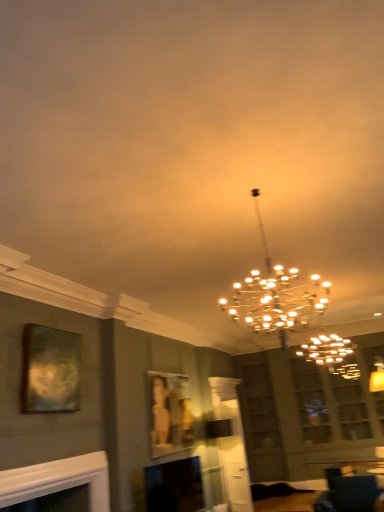
In order to face matte gold picture frame at center, placed as the first picture frame when sorted from bottom to top, should I rotate leftwards or rightwards?

Rotate left and turn 2.706 degrees.

The width and height of the screenshot is (384, 512). Describe the element at coordinates (349, 494) in the screenshot. I see `velvet dark blue sofa at lower right` at that location.

What are the coordinates of `white glossy fireplace at lower left, arranged as the 1th fireplace when viewed from the front` in the screenshot? It's located at (58, 480).

Identify the location of matte black fireplace at lower left, which is the second fireplace from front to back. (174, 486).

This screenshot has height=512, width=384. Find the location of `matte gold picture frame at center, acting as the first picture frame starting from the right`. matte gold picture frame at center, acting as the first picture frame starting from the right is located at coordinates (169, 413).

From a real-world perspective, relative to metallic gold picture frame at upper left, the second picture frame in the bottom-to-top sequence, is metallic gold chandelier at center vertically above or below?

Clearly, from a real-world perspective, metallic gold chandelier at center is above metallic gold picture frame at upper left, the second picture frame in the bottom-to-top sequence.

Which is less distant, (x=293, y=292) or (x=44, y=394)?

The point (x=44, y=394) is closer.

Between metallic gold chandelier at center and metallic gold picture frame at upper left, the second picture frame in the bottom-to-top sequence, which one has larger width?

metallic gold chandelier at center.

I want to click on the 1st picture frame behind the metallic gold chandelier at center, starting your count from the anchor, so click(50, 370).

Is point (340, 496) farther from viewer compared to point (168, 380)?

No, (340, 496) is closer to viewer.

From the image's perspective, relative to matte gold picture frame at center, acting as the first picture frame starting from the right, is velvet dark blue sofa at lower right above or below?

From the image's perspective, velvet dark blue sofa at lower right appears below matte gold picture frame at center, acting as the first picture frame starting from the right.

Which picture frame is the 1st one when counting from the left side of the velvet dark blue sofa at lower right? Please provide its 2D coordinates.

[(169, 413)]

From a real-world perspective, is velvet dark blue sofa at lower right positioned under matte gold picture frame at center, which appears as the second picture frame when viewed from the top, based on gravity?

Correct, in the physical world, velvet dark blue sofa at lower right is lower than matte gold picture frame at center, which appears as the second picture frame when viewed from the top.

Is metallic gold picture frame at upper left, positioned as the second picture frame in right-to-left order, behind velvet dark blue sofa at lower right?

No.

Visually, is metallic gold picture frame at upper left, the second picture frame in the bottom-to-top sequence, positioned to the left or to the right of velvet dark blue sofa at lower right?

From the image, it's evident that metallic gold picture frame at upper left, the second picture frame in the bottom-to-top sequence, is to the left of velvet dark blue sofa at lower right.

Is metallic gold picture frame at upper left, the second picture frame in the bottom-to-top sequence, thinner than velvet dark blue sofa at lower right?

Correct, the width of metallic gold picture frame at upper left, the second picture frame in the bottom-to-top sequence, is less than that of velvet dark blue sofa at lower right.

Consider the image. Is velvet dark blue sofa at lower right inside metallic gold picture frame at upper left, the 1th picture frame positioned from the left?

That's incorrect, velvet dark blue sofa at lower right is not inside metallic gold picture frame at upper left, the 1th picture frame positioned from the left.

From a real-world perspective, between white glossy fireplace at lower left, the second fireplace viewed from the back, and matte gold picture frame at center, placed as the first picture frame when sorted from bottom to top, who is vertically lower?

white glossy fireplace at lower left, the second fireplace viewed from the back, from a real-world perspective.

Is white glossy fireplace at lower left, the 1th fireplace when ordered from left to right, oriented towards matte gold picture frame at center, positioned as the second picture frame in front-to-back order?

No.

Based on the photo, is white glossy fireplace at lower left, the second fireplace viewed from the back, spatially inside matte gold picture frame at center, the 2th picture frame from the left, or outside of it?

white glossy fireplace at lower left, the second fireplace viewed from the back, cannot be found inside matte gold picture frame at center, the 2th picture frame from the left.

From the image's perspective, who appears lower, white glossy fireplace at lower left, arranged as the second fireplace when viewed from the right, or matte gold picture frame at center, acting as the first picture frame starting from the right?

From the image's view, matte gold picture frame at center, acting as the first picture frame starting from the right, is below.

Is metallic gold picture frame at upper left, the second picture frame in the bottom-to-top sequence, spatially inside metallic gold chandelier at center, or outside of it?

metallic gold picture frame at upper left, the second picture frame in the bottom-to-top sequence, is outside metallic gold chandelier at center.

Does metallic gold picture frame at upper left, the second picture frame in the bottom-to-top sequence, have a greater width compared to metallic gold chandelier at center?

No, metallic gold picture frame at upper left, the second picture frame in the bottom-to-top sequence, is not wider than metallic gold chandelier at center.

Which of these two, metallic gold picture frame at upper left, which is the 1th picture frame in top-to-bottom order, or metallic gold chandelier at center, is smaller?

With smaller size is metallic gold picture frame at upper left, which is the 1th picture frame in top-to-bottom order.

Consider the image. Is metallic gold picture frame at upper left, placed as the 2th picture frame when sorted from back to front, taller or shorter than metallic gold chandelier at center?

In the image, metallic gold picture frame at upper left, placed as the 2th picture frame when sorted from back to front, appears to be shorter than metallic gold chandelier at center.

Is white glossy fireplace at lower left, arranged as the 1th fireplace when viewed from the front, oriented away from metallic gold chandelier at center?

No.

From the image's perspective, relative to metallic gold chandelier at center, is white glossy fireplace at lower left, the 1th fireplace when ordered from left to right, above or below?

Based on their image positions, white glossy fireplace at lower left, the 1th fireplace when ordered from left to right, is located beneath metallic gold chandelier at center.

Is point (109, 506) positioned after point (270, 327)?

No, (109, 506) is in front of (270, 327).

Is point (150, 483) behind point (55, 492)?

Yes, it is.

Is matte black fireplace at lower left, which is the second fireplace from front to back, surrounding white glossy fireplace at lower left, arranged as the 1th fireplace when viewed from the front?

No, white glossy fireplace at lower left, arranged as the 1th fireplace when viewed from the front, is located outside of matte black fireplace at lower left, which is the second fireplace from front to back.

Locate an element on the screen. Image resolution: width=384 pixels, height=512 pixels. fireplace lying on the right of white glossy fireplace at lower left, the 1th fireplace when ordered from left to right is located at coordinates (174, 486).

Is white glossy fireplace at lower left, arranged as the 1th fireplace when viewed from the front, at the back of matte black fireplace at lower left, which is the first fireplace in right-to-left order?

No, matte black fireplace at lower left, which is the first fireplace in right-to-left order, is not facing away from white glossy fireplace at lower left, arranged as the 1th fireplace when viewed from the front.

Identify the location of lamp above the metallic gold picture frame at upper left, which is the 1th picture frame in top-to-bottom order (from a real-world perspective). This screenshot has width=384, height=512. (276, 296).

At what (x,y) coordinates should I click in order to perform the action: click on furniture in front of the matte gold picture frame at center, which appears as the second picture frame when viewed from the top. Please return your answer as a coordinate pair (x, y). Looking at the image, I should click on (349, 494).

Considering their positions, is velvet dark blue sofa at lower right positioned further to metallic gold picture frame at upper left, positioned as the second picture frame in right-to-left order, than matte black fireplace at lower left, the second fireplace when ordered from left to right?

velvet dark blue sofa at lower right.

Looking at the image, which one is located further to metallic gold picture frame at upper left, the first picture frame viewed from the front, velvet dark blue sofa at lower right or metallic gold chandelier at center?

velvet dark blue sofa at lower right lies further to metallic gold picture frame at upper left, the first picture frame viewed from the front, than the other object.

Considering their positions, is matte gold picture frame at center, which appears as the second picture frame when viewed from the top, positioned closer to metallic gold picture frame at upper left, the 1th picture frame positioned from the left, than matte black fireplace at lower left, the second fireplace when ordered from left to right?

matte gold picture frame at center, which appears as the second picture frame when viewed from the top, is positioned closer to the anchor metallic gold picture frame at upper left, the 1th picture frame positioned from the left.

Based on their spatial positions, is metallic gold picture frame at upper left, placed as the 2th picture frame when sorted from back to front, or velvet dark blue sofa at lower right closer to matte black fireplace at lower left, which is the second fireplace from front to back?

velvet dark blue sofa at lower right lies closer to matte black fireplace at lower left, which is the second fireplace from front to back, than the other object.

When comparing their distances from matte black fireplace at lower left, the 1th fireplace positioned from the back, does metallic gold picture frame at upper left, placed as the 2th picture frame when sorted from back to front, or metallic gold chandelier at center seem further?

metallic gold chandelier at center is positioned further to the anchor matte black fireplace at lower left, the 1th fireplace positioned from the back.

Based on their spatial positions, is metallic gold chandelier at center or matte gold picture frame at center, acting as the first picture frame starting from the right, further from white glossy fireplace at lower left, arranged as the 1th fireplace when viewed from the front?

metallic gold chandelier at center is further to white glossy fireplace at lower left, arranged as the 1th fireplace when viewed from the front.

Looking at the image, which one is located closer to matte gold picture frame at center, acting as the first picture frame starting from the right, velvet dark blue sofa at lower right or matte black fireplace at lower left, which is the first fireplace in right-to-left order?

matte black fireplace at lower left, which is the first fireplace in right-to-left order.

Estimate the real-world distances between objects in this image. Which object is further from white glossy fireplace at lower left, arranged as the 1th fireplace when viewed from the front, matte black fireplace at lower left, which is the first fireplace in right-to-left order, or velvet dark blue sofa at lower right?

velvet dark blue sofa at lower right lies further to white glossy fireplace at lower left, arranged as the 1th fireplace when viewed from the front, than the other object.

I want to click on fireplace between white glossy fireplace at lower left, the 1th fireplace when ordered from left to right, and velvet dark blue sofa at lower right, in the horizontal direction, so click(x=174, y=486).

Where is `lamp located between metallic gold picture frame at upper left, positioned as the second picture frame in right-to-left order, and velvet dark blue sofa at lower right in the left-right direction`? The image size is (384, 512). lamp located between metallic gold picture frame at upper left, positioned as the second picture frame in right-to-left order, and velvet dark blue sofa at lower right in the left-right direction is located at coordinates (276, 296).

The width and height of the screenshot is (384, 512). What are the coordinates of `picture frame positioned between white glossy fireplace at lower left, the second fireplace viewed from the back, and matte gold picture frame at center, positioned as the second picture frame in front-to-back order, from near to far` in the screenshot? It's located at (50, 370).

Identify the location of lamp between white glossy fireplace at lower left, the second fireplace viewed from the back, and velvet dark blue sofa at lower right from left to right. (276, 296).